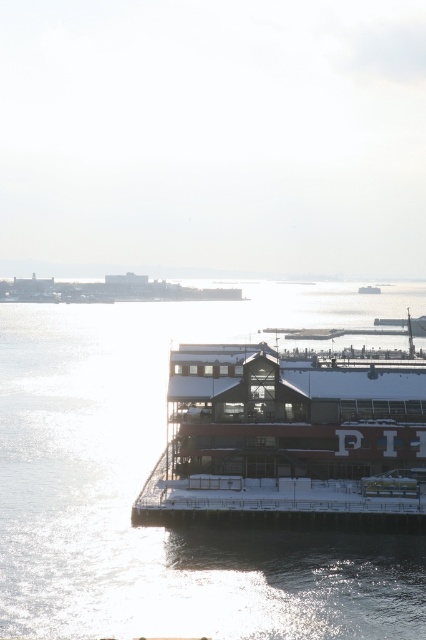
Question: Is glistening water at lower center further to camera compared to snow-covered wooden pier at center?

Choices:
 (A) no
 (B) yes

Answer: (A)

Question: Does glistening water at lower center lie in front of snow-covered wooden pier at center?

Choices:
 (A) no
 (B) yes

Answer: (B)

Question: Among these points, which one is nearest to the camera?

Choices:
 (A) (357, 358)
 (B) (331, 323)

Answer: (A)

Question: Which point is closer to the camera taking this photo?

Choices:
 (A) (233, 320)
 (B) (227, 371)

Answer: (B)

Question: Is glistening water at lower center wider than snow-covered wooden pier at center?

Choices:
 (A) yes
 (B) no

Answer: (A)